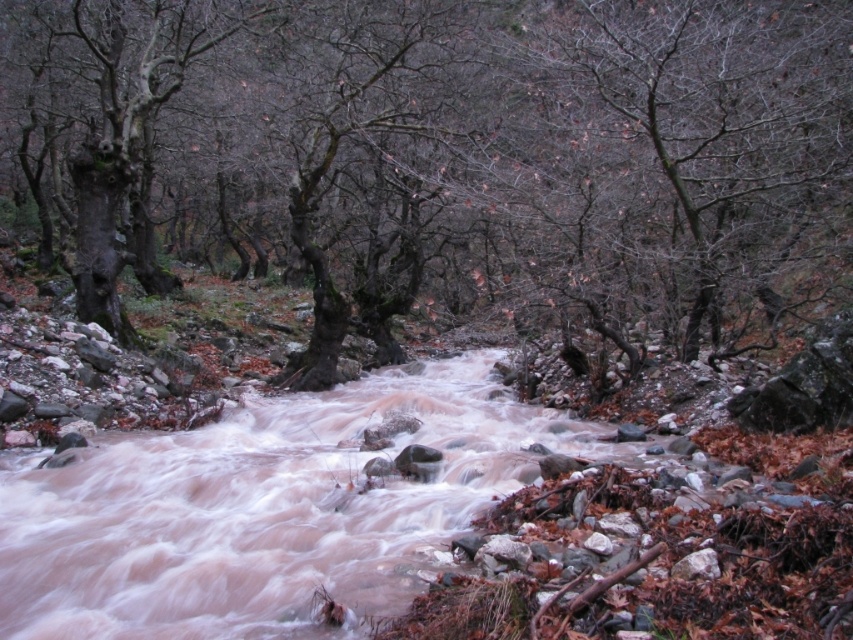
You are an environmental scientist analyzing the forest composition. You observe the smooth bark tree at upper right and the dark brown rough bark tree at left. Which tree takes up more area in the forest composition analysis?

The dark brown rough bark tree at left occupies more space than the smooth bark tree at upper right, so it takes up more area in the forest composition analysis.

You are a hiker who wants to cross the river using the trees as landmarks. If you are standing at the dark brown rough bark tree at left, which direction should you walk to reach the smooth bark tree at upper right?

The smooth bark tree at upper right is to the right of the dark brown rough bark tree at left, so you should walk to the right to reach it.

You are a hiker trying to cross the river using the trees as landmarks. If you face the smooth bark tree at upper right, which direction should you turn to find the dark brown rough bark tree at left?

Since the smooth bark tree at upper right is in front of the dark brown rough bark tree at left, you should turn to your left to locate the dark brown rough bark tree at left.